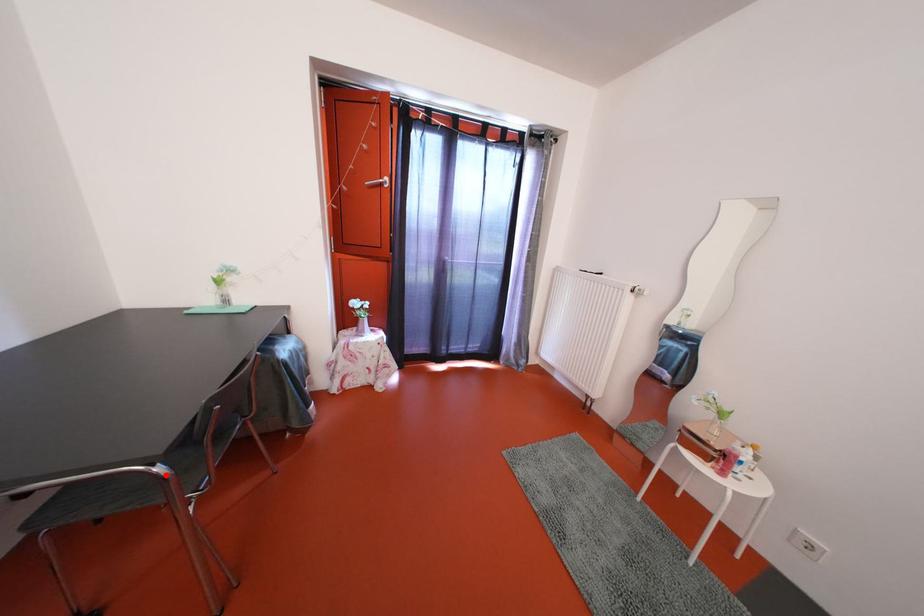
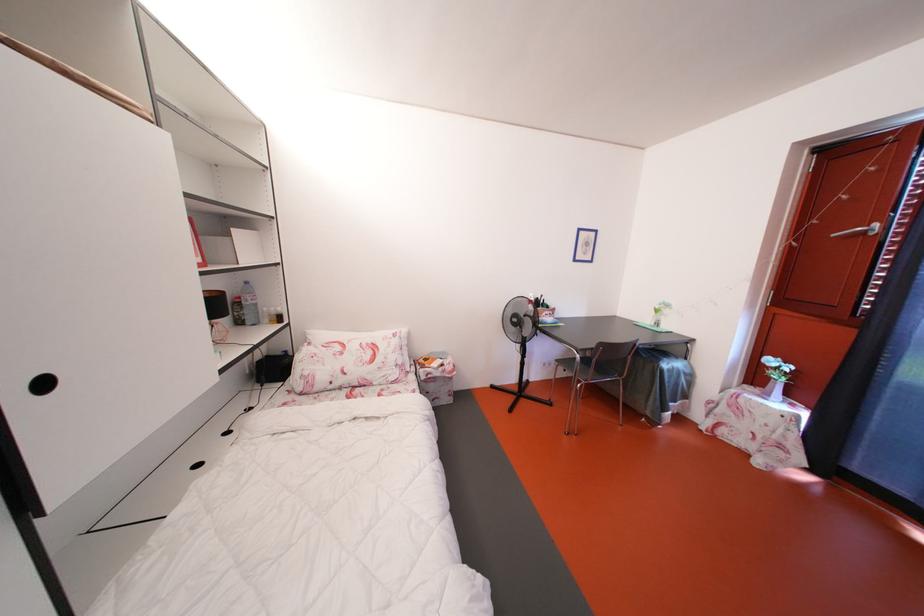
Find the pixel in the second image that matches the highlighted location in the first image.

(585, 362)